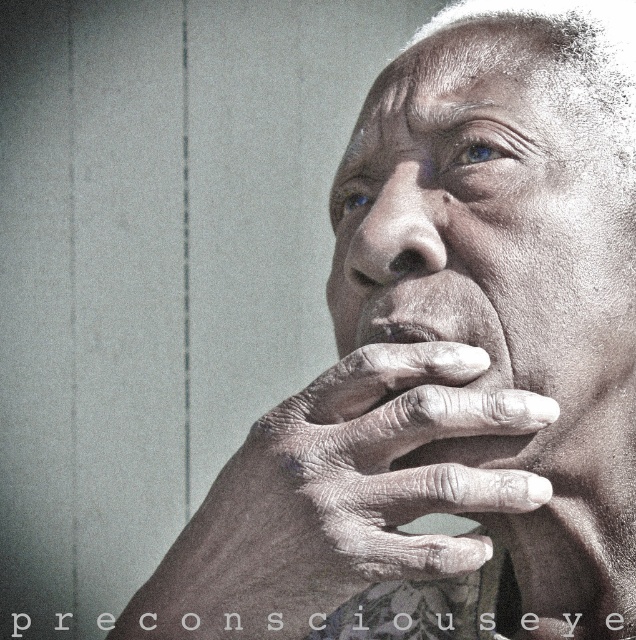
You are taking a photo of a person and notice two points on their face. The first point is at coordinates point (431, 244) and the second is at point (408, 321). Based on the image, which point is closer to the camera?

Point (431, 244) is further to the camera than point (408, 321), so the second point is closer to the camera.

You are an artist analyzing the composition of this portrait. The gray textured hand at center is positioned at a specific coordinate. Can you determine if this hand is closer to the top or bottom of the image?

The gray textured hand at center is located at point 0.777 on the y axis, which is closer to the bottom of the image since lower y values are closer to the bottom.